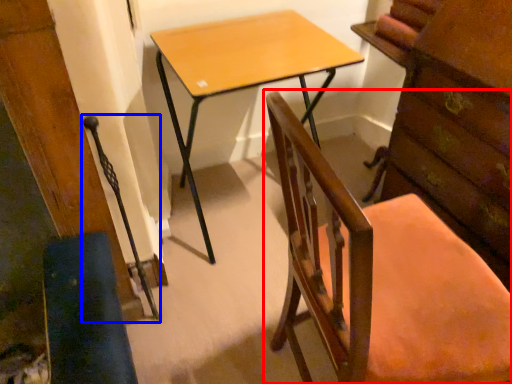
Question: Which of the following is the closest to the observer, chair (highlighted by a red box) or swivel chair (highlighted by a blue box)?

Choices:
 (A) chair
 (B) swivel chair

Answer: (A)